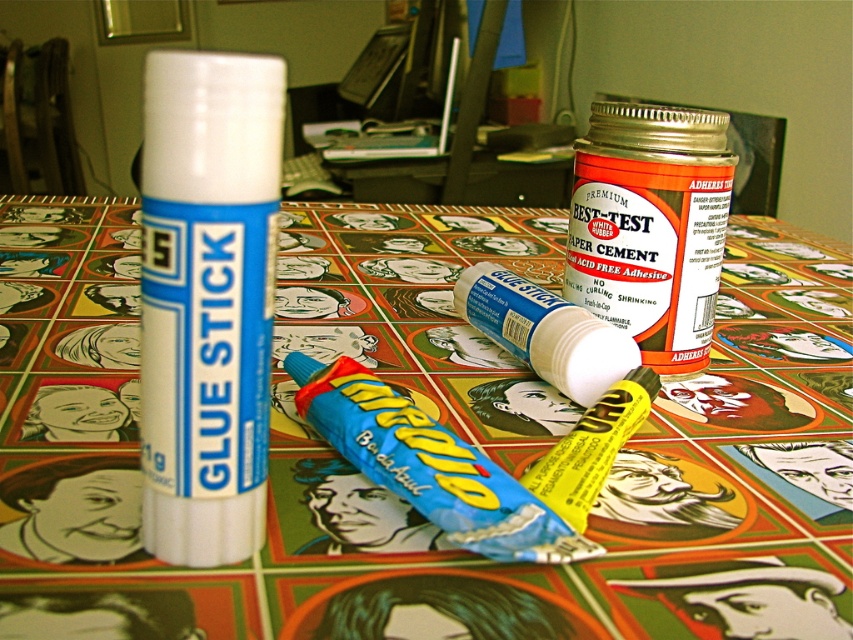
You have a white matte glue stick at center and a clear liquid glue bottle at lower right. You want to place both items on a shelf that can only hold items within 30 cm of each other. Can they be placed together?

The white matte glue stick at center and the clear liquid glue bottle at lower right are 27.33 centimeters apart, so they can be placed together on the shelf since the distance is within the 30 cm limit.

Based on the photo, you are organizing a craft station and need to place the white matte glue stick at center and the yellow matte lip balm at center on a shelf. Based on their positions in the image, which item should you place closer to the front of the shelf?

The white matte glue stick at center should be placed closer to the front of the shelf since it is positioned in front of the yellow matte glue stick at center in the image.

You are organizing a craft station and need to place the white matte glue stick at center and the yellow matte lip balm at center in a vertical arrangement. Which item should you place on top to follow the current setup?

→ The yellow matte lip balm at center should be placed on top because the white matte glue stick at center is located below it in the current setup.